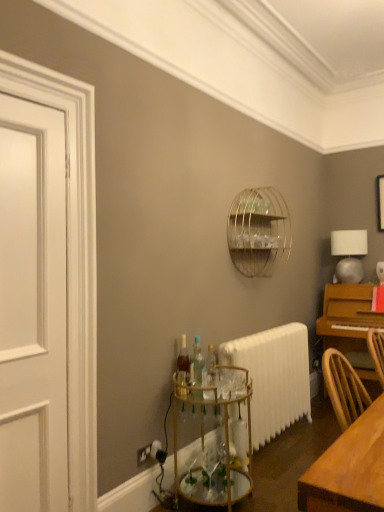
Question: Considering the positions of white painted wood door at left and translucent glass bottle at center, the 2th bottle in the front-to-back sequence, in the image, is white painted wood door at left bigger or smaller than translucent glass bottle at center, the 2th bottle in the front-to-back sequence,?

Choices:
 (A) big
 (B) small

Answer: (A)

Question: In the image, is white painted wood door at left on the left side or the right side of translucent glass bottle at center, the 2th bottle in the front-to-back sequence?

Choices:
 (A) left
 (B) right

Answer: (A)

Question: Which of these objects is positioned farthest from the gold metallic bar cart at lower center?

Choices:
 (A) light brown wooden table at lower right
 (B) gold wire birdcage at upper center
 (C) white painted radiator at lower center
 (D) white matte table lamp at upper right
 (E) clear glass bottles at center, which is the first bottle from front to back

Answer: (D)

Question: Estimate the real-world distances between objects in this image. Which object is farther from the light brown wooden table at lower right?

Choices:
 (A) gold wire birdcage at upper center
 (B) white painted wood door at left
 (C) white painted radiator at lower center
 (D) gold metallic bar cart at lower center
 (E) clear glass bottles at center, which is the first bottle from front to back

Answer: (A)